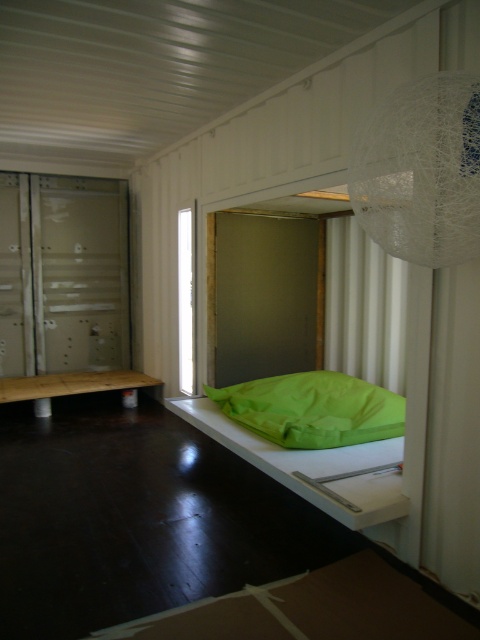
Question: In this image, where is green fabric bed at center located relative to green fabric pillow at lower center?

Choices:
 (A) left
 (B) right

Answer: (A)

Question: Which object is closer to the camera taking this photo?

Choices:
 (A) green fabric pillow at lower center
 (B) green fabric bed at center

Answer: (B)

Question: Does green fabric bed at center have a larger size compared to green fabric pillow at lower center?

Choices:
 (A) no
 (B) yes

Answer: (B)

Question: Does green fabric bed at center have a greater width compared to green fabric pillow at lower center?

Choices:
 (A) yes
 (B) no

Answer: (A)